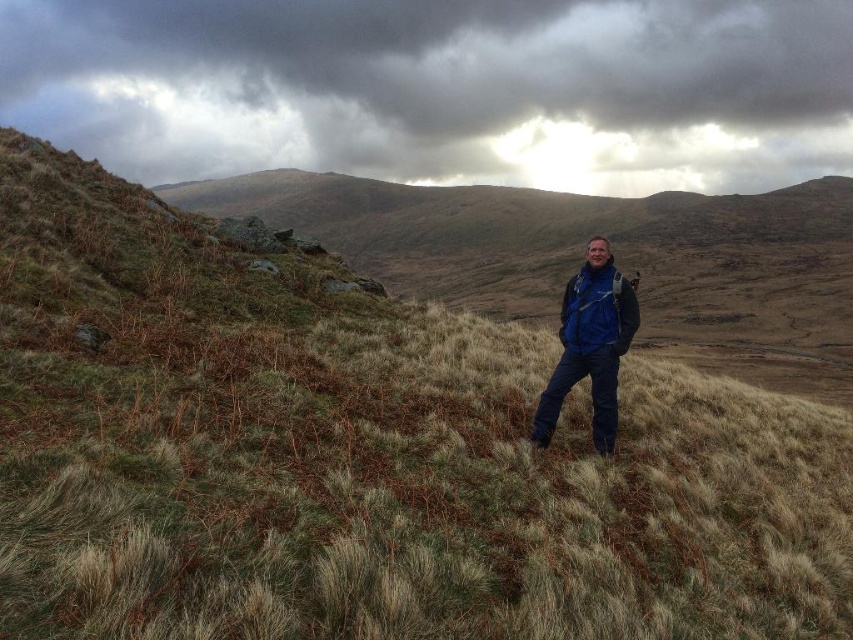
Question: Estimate the real-world distances between objects in this image. Which object is closer to the dark cloudy sky at upper center?

Choices:
 (A) blue fabric jacket at center
 (B) blue fleece jacket at center

Answer: (B)

Question: Is blue fabric jacket at center positioned behind blue fleece jacket at center?

Choices:
 (A) no
 (B) yes

Answer: (B)

Question: Is dark cloudy sky at upper center thinner than blue fabric jacket at center?

Choices:
 (A) yes
 (B) no

Answer: (B)

Question: Is blue fabric jacket at center smaller than blue fleece jacket at center?

Choices:
 (A) yes
 (B) no

Answer: (A)

Question: Which point appears farthest from the camera in this image?

Choices:
 (A) (563, 316)
 (B) (94, 12)

Answer: (B)

Question: Estimate the real-world distances between objects in this image. Which object is closer to the blue fleece jacket at center?

Choices:
 (A) blue fabric jacket at center
 (B) dark cloudy sky at upper center

Answer: (A)